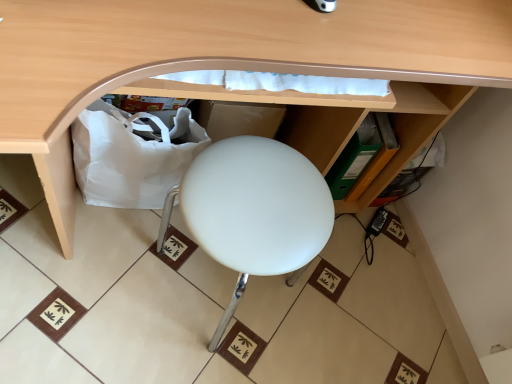
Where is `free space in front of white fabric bag at lower left`? This screenshot has width=512, height=384. free space in front of white fabric bag at lower left is located at coordinates (121, 249).